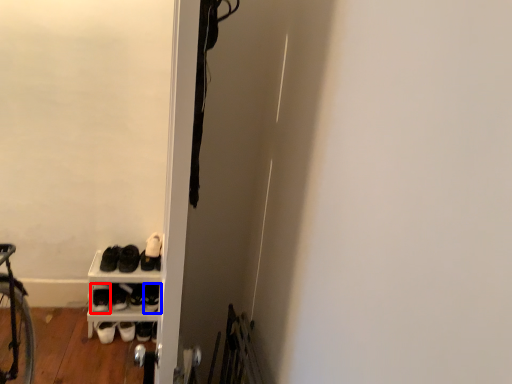
Question: Which object is closer to the camera taking this photo, footwear (highlighted by a red box) or footwear (highlighted by a blue box)?

Choices:
 (A) footwear
 (B) footwear

Answer: (A)